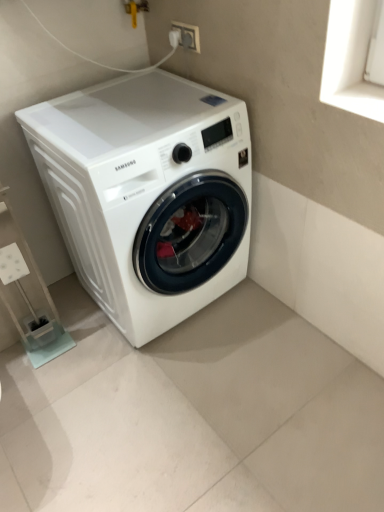
Image resolution: width=384 pixels, height=512 pixels. In order to click on free space in front of white plastic shelf at lower left in this screenshot , I will do `click(58, 375)`.